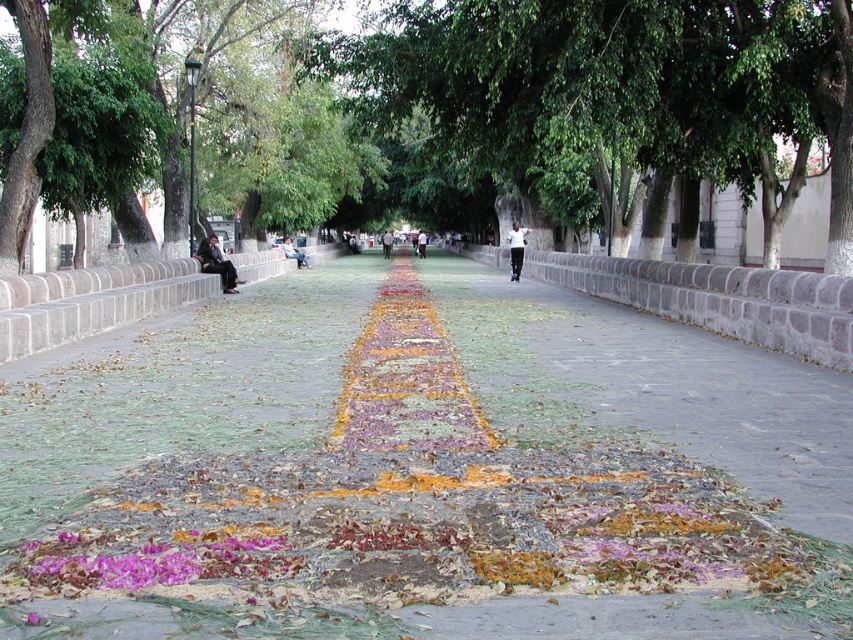
Question: Which point is farther from the camera taking this photo?

Choices:
 (A) (247, 260)
 (B) (33, 560)
 (C) (78, 436)

Answer: (A)

Question: Is gray stone curb at center smaller than purple floral carpet at center?

Choices:
 (A) no
 (B) yes

Answer: (A)

Question: Which object is positioned closest to the multicolored floral carpet at center?

Choices:
 (A) gray stone curb at center
 (B) purple floral carpet at center
 (C) green leafy tree at center
 (D) gray concrete bench at center

Answer: (B)

Question: Does multicolored floral carpet at center appear over gray stone curb at center?

Choices:
 (A) no
 (B) yes

Answer: (A)

Question: Which of the following is the closest to the observer?

Choices:
 (A) gray concrete bench at center
 (B) green leafy tree at center
 (C) multicolored floral carpet at center

Answer: (C)

Question: Is green leafy tree at center positioned in front of gray concrete bench at center?

Choices:
 (A) no
 (B) yes

Answer: (A)